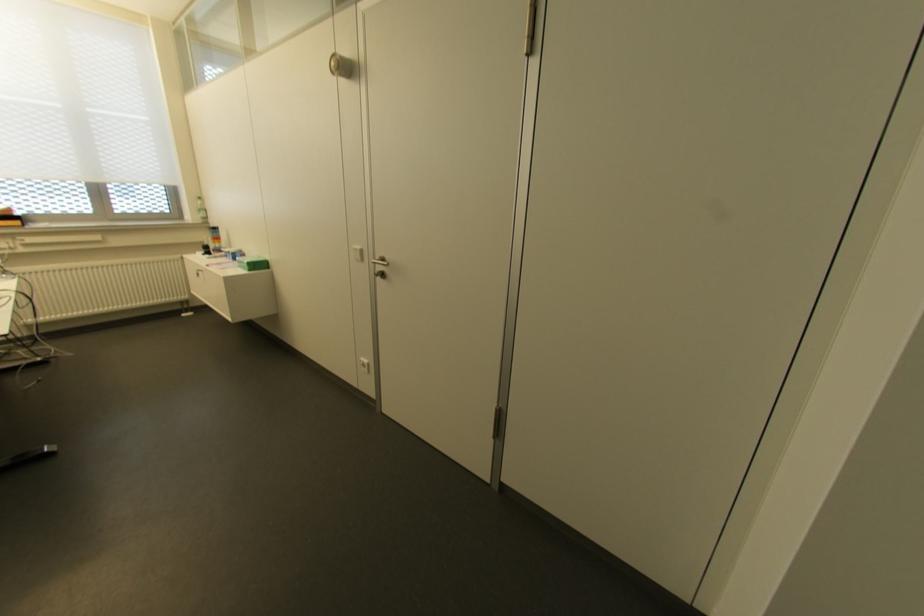
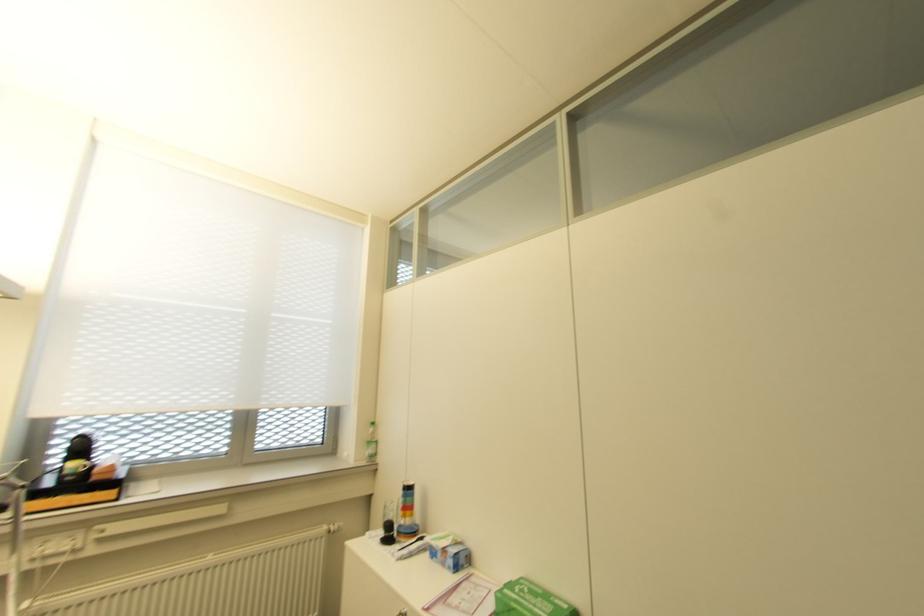
Find the pixel in the second image that matches pixel 205 254 in the first image.

(385, 540)